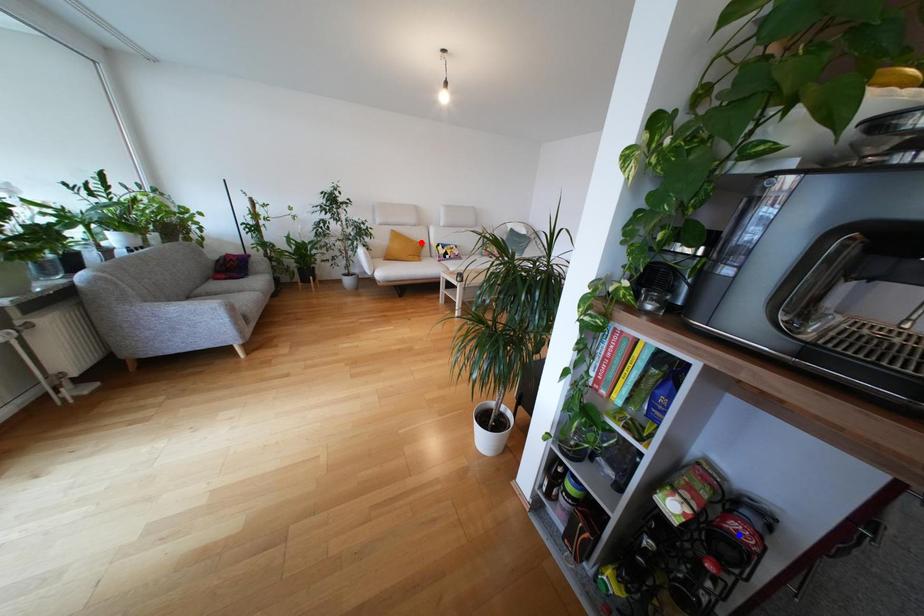
Question: Two points are marked on the image. Which point is closer to the camera?

Choices:
 (A) Blue point is closer.
 (B) Red point is closer.

Answer: (A)